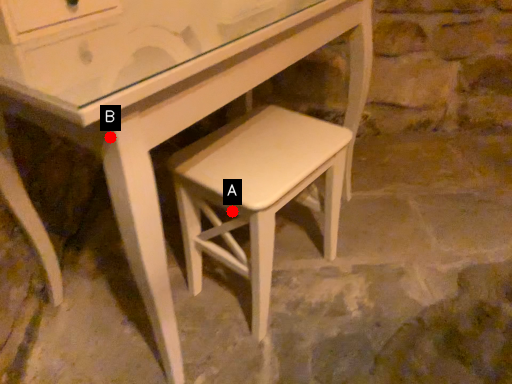
Question: Two points are circled on the image, labeled by A and B beside each circle. Which point is farther from the camera taking this photo?

Choices:
 (A) A is further
 (B) B is further

Answer: (A)